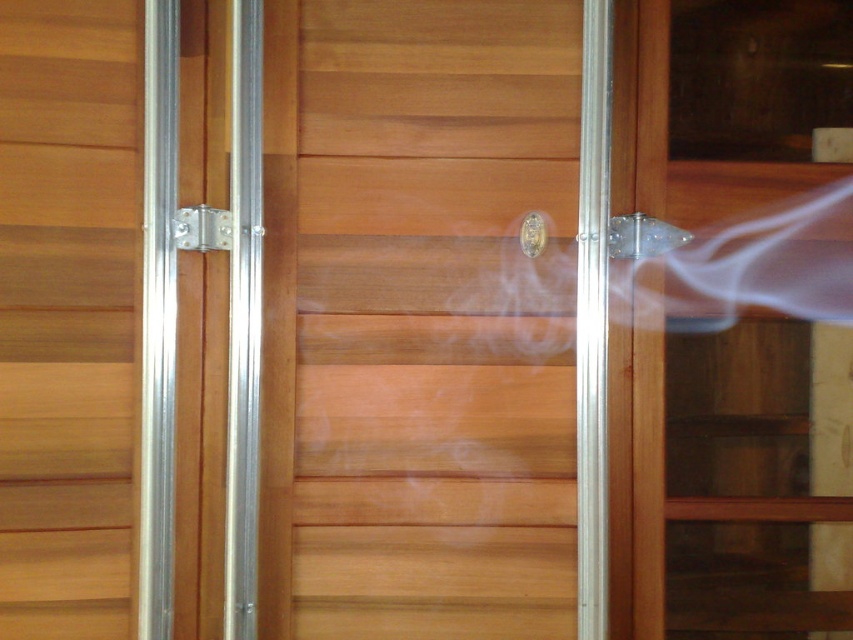
You are trying to open the door of the wooden structure shown in the scene. The door has a polished brass door handle at center and a clear plastic lock at center. Which object would you need to interact with first to open the door?

You would need to interact with the clear plastic lock at center first to unlock it before using the polished brass door handle at center to open the door.

You are standing in front of a rustic wooden structure and see the natural wood door at center and the silver metallic lock at center. Which object is positioned lower?

The natural wood door at center is positioned below the silver metallic lock at center, so the natural wood door at center is lower.